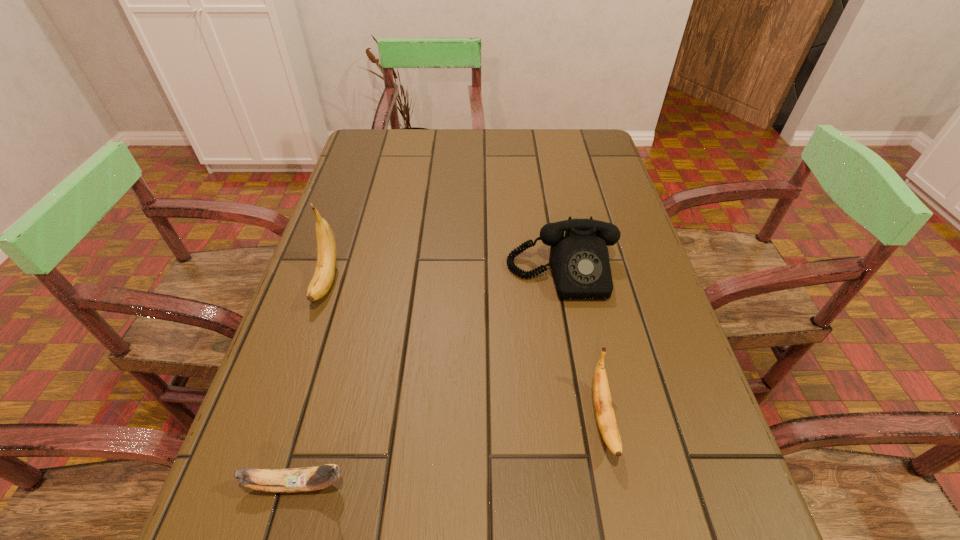
You are a GUI agent. You are given a task and a screenshot of the screen. Output one action in this format:
    pyautogui.click(x=<x>, y=<y>)
    Task: Click on the free space in the image that satisfies the following two spatial constraints: 1. on the dial of the telephone; 2. at the stem of the nearest banana
    This screenshot has width=960, height=540.
    Given the screenshot: What is the action you would take?
    click(601, 484)